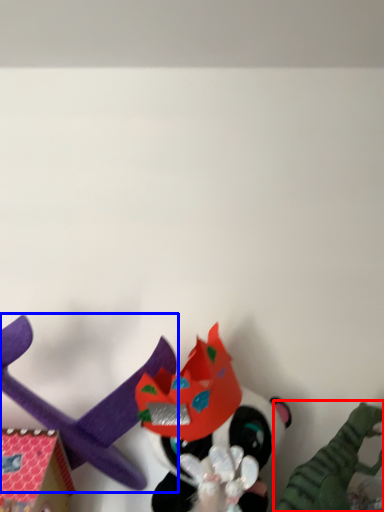
Question: Which object appears closest to the camera in this image, toy (highlighted by a red box) or toy (highlighted by a blue box)?

Choices:
 (A) toy
 (B) toy

Answer: (A)